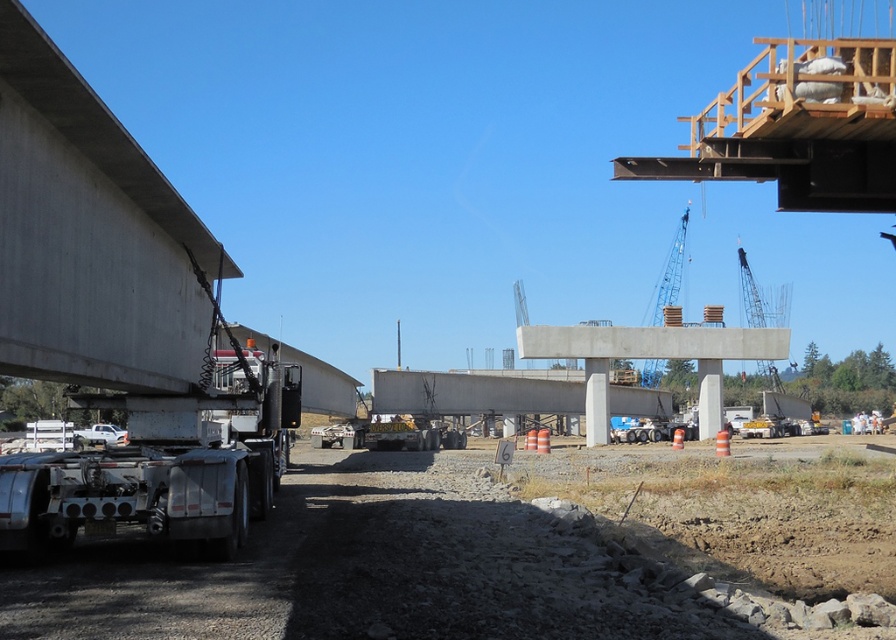
Question: Observing the image, what is the correct spatial positioning of silver metallic trailer truck at left in reference to blue metallic crane at upper center?

Choices:
 (A) left
 (B) right

Answer: (A)

Question: Does smooth concrete overpass at left lie in front of blue metallic crane at upper center?

Choices:
 (A) yes
 (B) no

Answer: (A)

Question: Estimate the real-world distances between objects in this image. Which object is closer to the silver metallic trailer truck at left?

Choices:
 (A) smooth concrete overpass at left
 (B) concrete at center
 (C) white concrete pillar at center

Answer: (A)

Question: Can you confirm if metallic gray crane at upper right is smaller than white concrete pillar at center?

Choices:
 (A) yes
 (B) no

Answer: (B)

Question: Which object is positioned farthest from the concrete at center?

Choices:
 (A) metallic gray crane at upper right
 (B) blue metallic crane at upper center

Answer: (A)

Question: Which point is farther to the camera?

Choices:
 (A) white concrete pillar at center
 (B) blue metallic crane at upper center
 (C) concrete at center

Answer: (B)